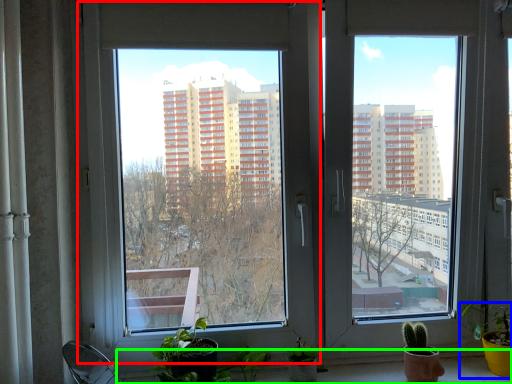
Question: Which object is positioned farthest from window (highlighted by a red box)? Select from houseplant (highlighted by a blue box) and window sill (highlighted by a green box).

Choices:
 (A) houseplant
 (B) window sill

Answer: (A)